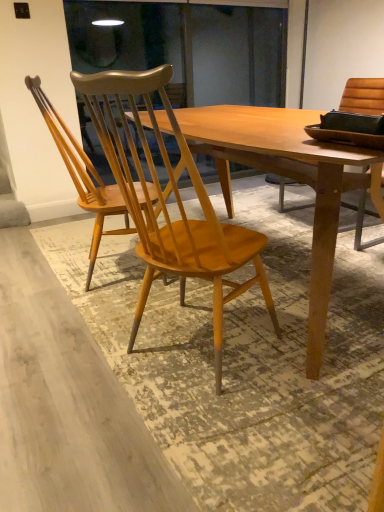
Identify the location of unoccupied area in front of light brown wood chair at center, the 1th chair viewed from the right. This screenshot has width=384, height=512. (242, 442).